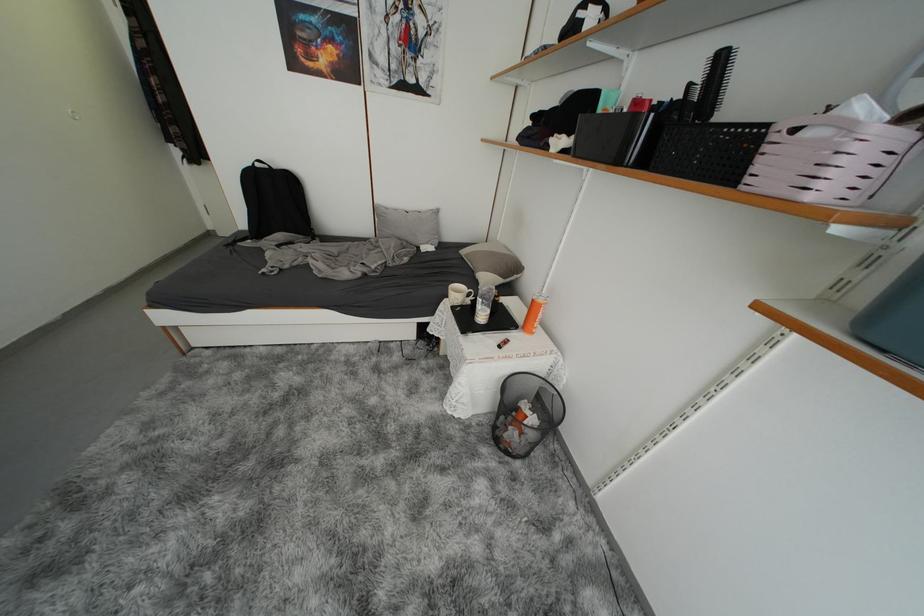
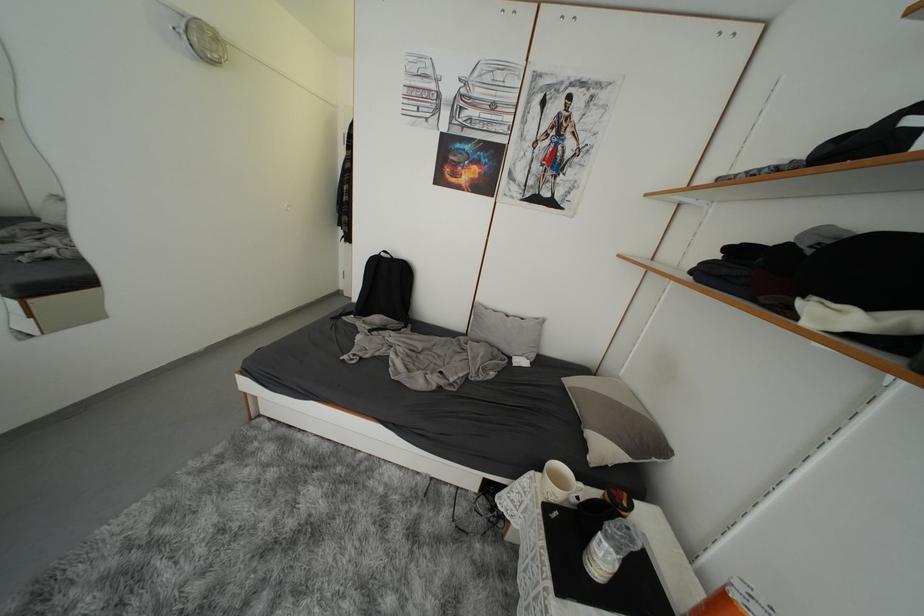
Which direction would the cameraman need to move to produce the second image?

The cameraman moved toward left, forward.